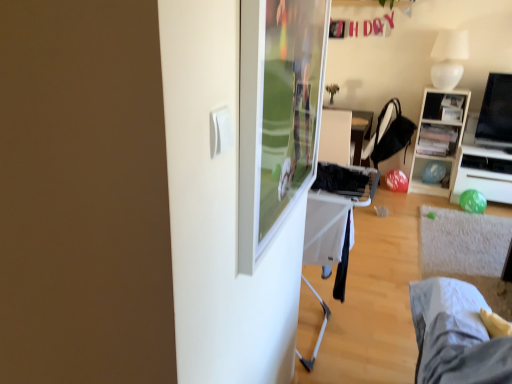
Where is `vacant space underneath black glossy tv at right (from a real-world perspective)`? The image size is (512, 384). vacant space underneath black glossy tv at right (from a real-world perspective) is located at coordinates (493, 151).